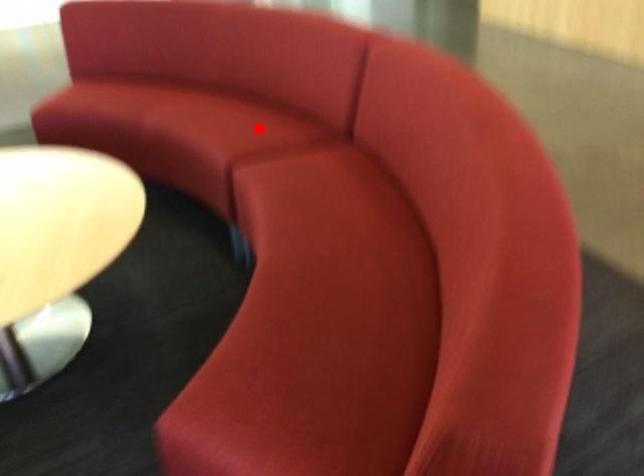
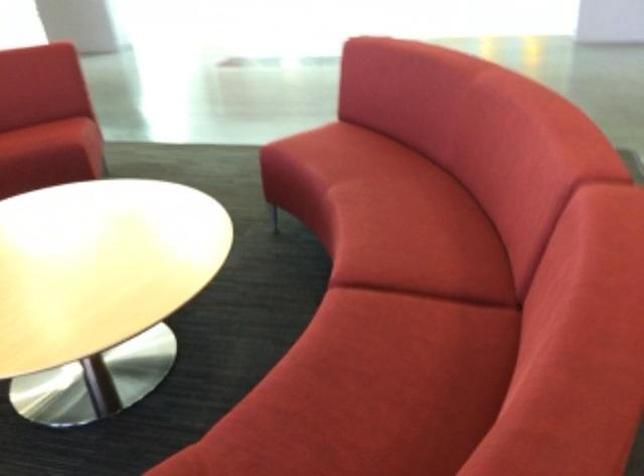
Locate, in the second image, the point that corresponds to the highlighted location in the first image.

(418, 239)